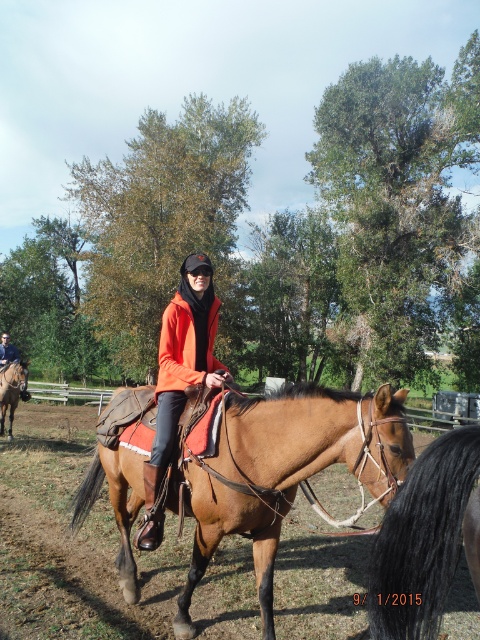
You are a photographer trying to capture a closeup of both the black glossy horse tail at lower right and the brown leather saddle at left in the scene. Given their sizes, which one might require you to move closer to get a clear shot?

The black glossy horse tail at lower right occupies less space than the brown leather saddle at left, so you would need to move closer to the black glossy horse tail at lower right to capture it clearly in the closeup.

Looking at this image, you are a photographer trying to capture the rider and the saddle in the same frame. Based on their positions, will the orange matte jacket at center and the brown leather saddle at left both be clearly visible in your photo?

The orange matte jacket at center is closer to the viewer than the brown leather saddle at left, so both will be clearly visible in the photo as they are positioned within the same frame.